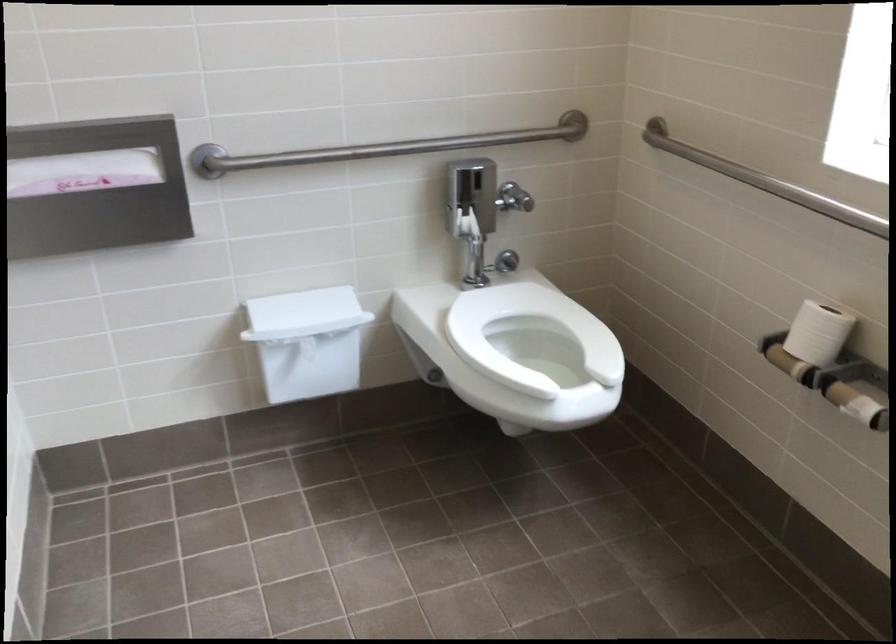
This screenshot has width=896, height=644. In order to click on toilet seat cover in this screenshot , I will do `click(530, 335)`.